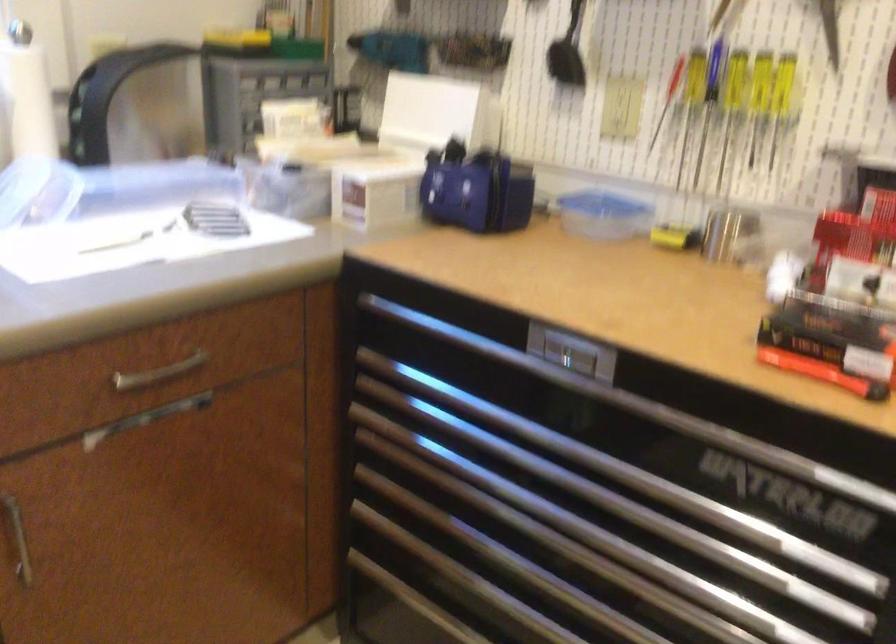
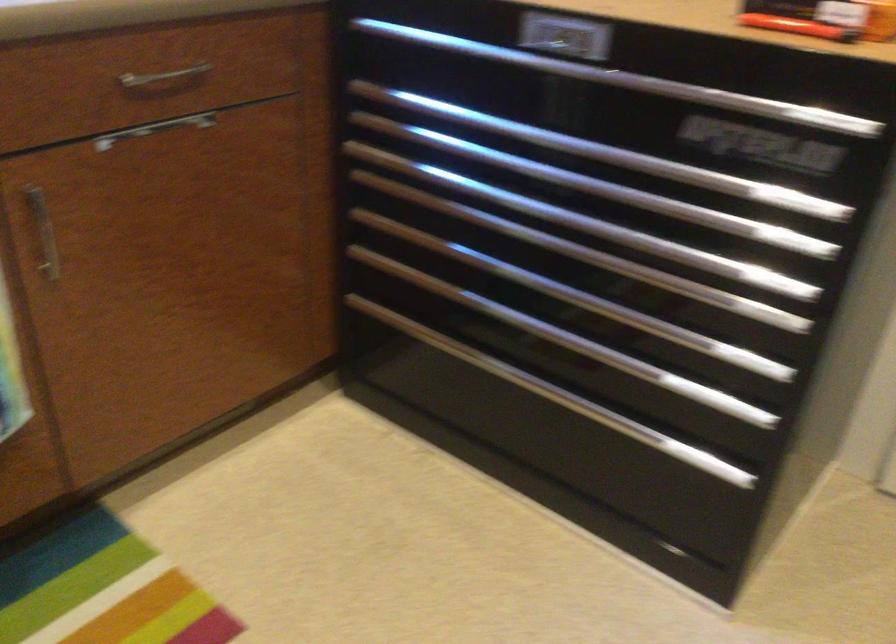
The images are taken continuously from a first-person perspective. In which direction are you moving?

The movement direction of the cameraman is left, backward.